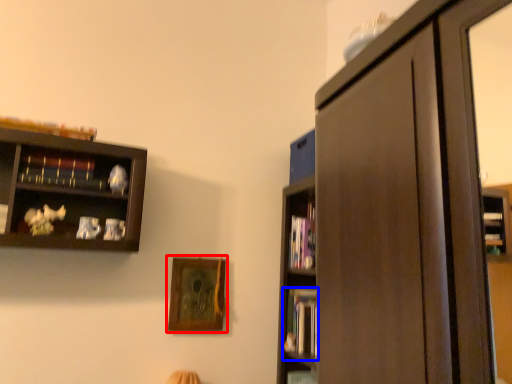
Question: Which object is further to the camera taking this photo, picture frame (highlighted by a red box) or book (highlighted by a blue box)?

Choices:
 (A) picture frame
 (B) book

Answer: (B)